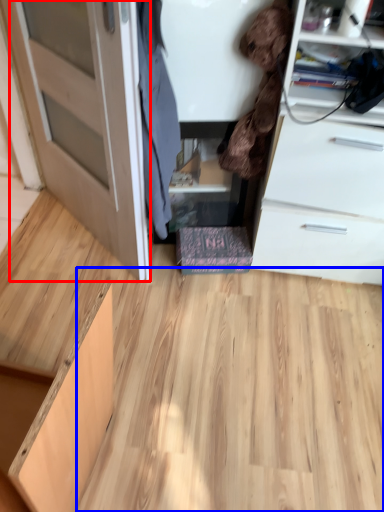
Question: Which point is further to the camera, door (highlighted by a red box) or plywood (highlighted by a blue box)?

Choices:
 (A) door
 (B) plywood

Answer: (B)